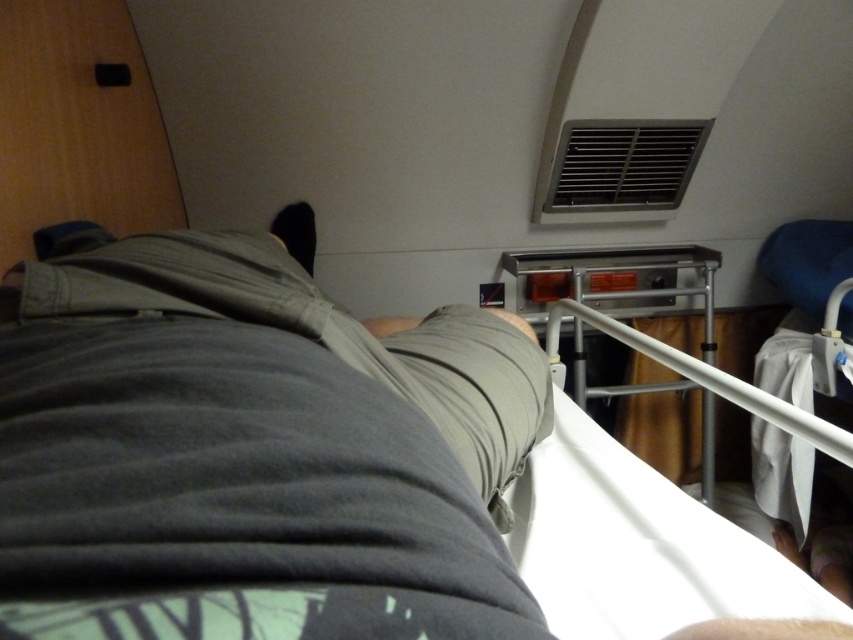
Question: Can you confirm if white plastic hospital bed at lower right is positioned below metallic gray rail at center?

Choices:
 (A) yes
 (B) no

Answer: (A)

Question: Does gray cotton shorts at center appear on the right side of white plastic hospital bed at lower right?

Choices:
 (A) no
 (B) yes

Answer: (A)

Question: Among these objects, which one is nearest to the camera?

Choices:
 (A) white plastic hospital bed at lower right
 (B) gray cotton shorts at center

Answer: (B)

Question: Which point appears closest to the camera in this image?

Choices:
 (A) (761, 605)
 (B) (590, 252)

Answer: (A)

Question: Which point is farther from the camera taking this photo?

Choices:
 (A) (651, 628)
 (B) (515, 321)
 (C) (711, 273)

Answer: (C)

Question: Does gray cotton shorts at center appear under white plastic hospital bed at lower right?

Choices:
 (A) no
 (B) yes

Answer: (A)